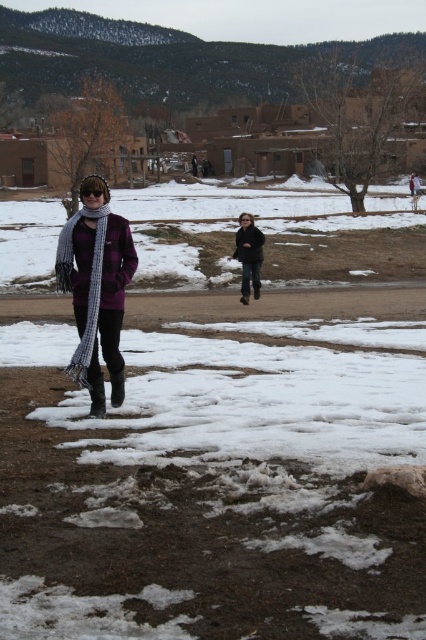
Is plaid wool scarf at left shorter than dark gray jacket at center?

In fact, plaid wool scarf at left may be taller than dark gray jacket at center.

Is point (103, 241) closer to camera compared to point (256, 289)?

Yes, point (103, 241) is in front of point (256, 289).

Which is in front, point (77, 365) or point (245, 234)?

Point (77, 365) is in front.

In order to click on plaid wool scarf at left in this screenshot , I will do `click(89, 284)`.